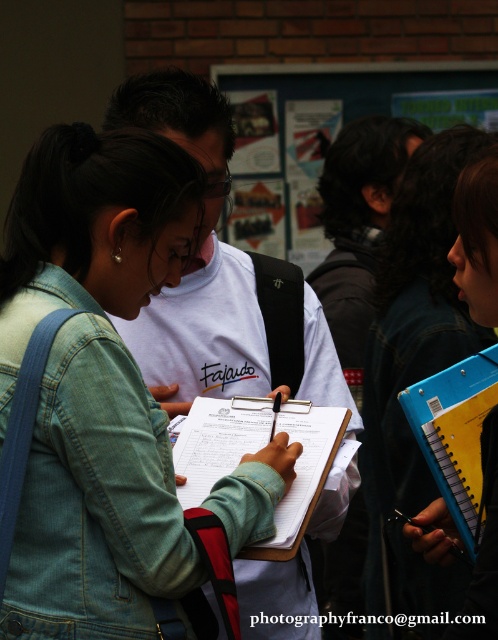
Question: Does blue plastic folder at center appear on the left side of blue plastic notebook at lower right?

Choices:
 (A) yes
 (B) no

Answer: (B)

Question: Can you confirm if blue plastic folder at center is bigger than white paper clipboard at center?

Choices:
 (A) yes
 (B) no

Answer: (A)

Question: Estimate the real-world distances between objects in this image. Which object is closer to the blue plastic notebook at lower right?

Choices:
 (A) white paper clipboard at center
 (B) blue plastic folder at center

Answer: (A)

Question: Observing the image, what is the correct spatial positioning of white paper clipboard at center in reference to blue plastic notebook at lower right?

Choices:
 (A) right
 (B) left

Answer: (B)

Question: Which point is closer to the camera?

Choices:
 (A) blue plastic notebook at lower right
 (B) white paper clipboard at center

Answer: (B)

Question: Which point appears closest to the camera in this image?

Choices:
 (A) (179, 314)
 (B) (451, 371)
 (C) (216, 456)
 (D) (460, 564)

Answer: (C)